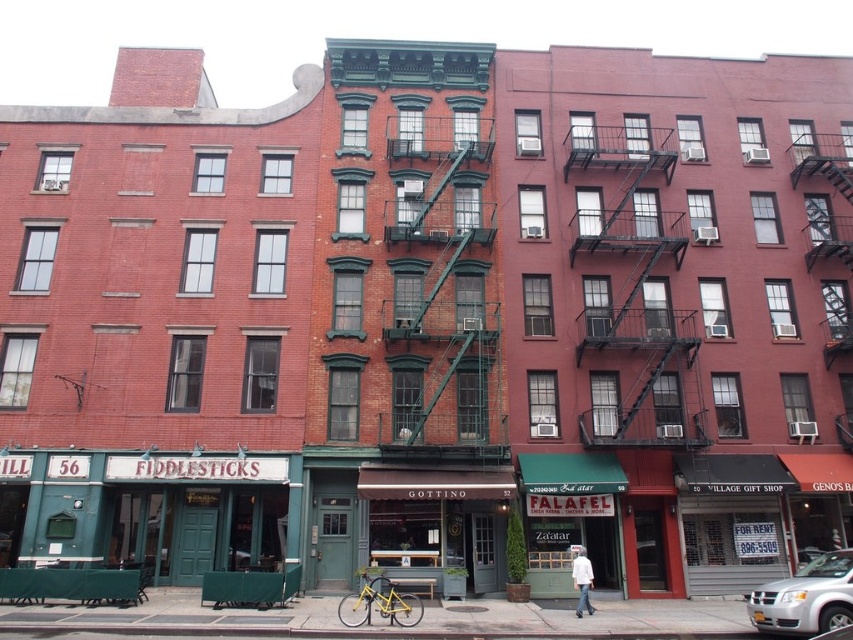
Between yellow matte bicycle at center and white cotton shirt at center, which one is positioned higher?

yellow matte bicycle at center is above.

What do you see at coordinates (379, 604) in the screenshot?
I see `yellow matte bicycle at center` at bounding box center [379, 604].

This screenshot has width=853, height=640. Identify the location of yellow matte bicycle at center. (379, 604).

Is silver metallic van at lower right above white cotton shirt at center?

Indeed, silver metallic van at lower right is positioned over white cotton shirt at center.

Is silver metallic van at lower right closer to camera compared to white cotton shirt at center?

Yes, it is.

Who is more distant from viewer, (770, 612) or (584, 561)?

Positioned behind is point (584, 561).

Locate an element on the screen. The width and height of the screenshot is (853, 640). silver metallic van at lower right is located at coordinates (805, 596).

Between silver metallic van at lower right and yellow matte bicycle at center, which one appears on the left side from the viewer's perspective?

From the viewer's perspective, yellow matte bicycle at center appears more on the left side.

Which is below, silver metallic van at lower right or yellow matte bicycle at center?

Positioned lower is yellow matte bicycle at center.

The height and width of the screenshot is (640, 853). Find the location of `silver metallic van at lower right`. silver metallic van at lower right is located at coordinates (805, 596).

At what (x,y) coordinates should I click in order to perform the action: click on silver metallic van at lower right. Please return your answer as a coordinate pair (x, y). This screenshot has height=640, width=853. Looking at the image, I should click on click(x=805, y=596).